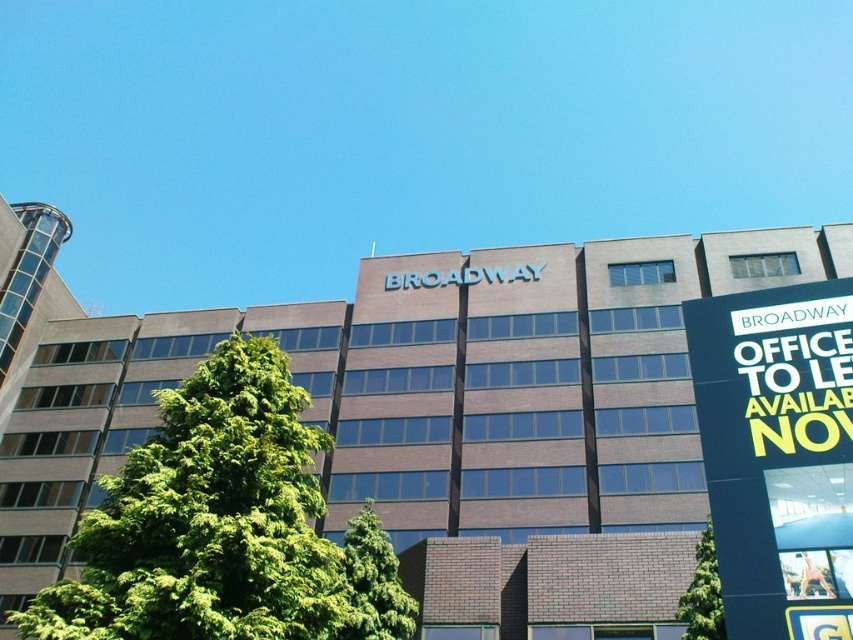
Question: Which point is closer to the camera?

Choices:
 (A) green leafy tree at left
 (B) blue plastic signboard at upper right
 (C) green leafy tree at center

Answer: (B)

Question: Which object appears closest to the camera in this image?

Choices:
 (A) green leafy tree at center
 (B) green leafy tree at left

Answer: (B)

Question: Considering the relative positions of green leafy tree at left and blue plastic signboard at upper right in the image provided, where is green leafy tree at left located with respect to blue plastic signboard at upper right?

Choices:
 (A) below
 (B) above

Answer: (A)

Question: Can you confirm if blue plastic signboard at upper right is thinner than green leafy tree at center?

Choices:
 (A) yes
 (B) no

Answer: (A)

Question: Which point appears closest to the camera in this image?

Choices:
 (A) (705, 604)
 (B) (792, 336)

Answer: (B)

Question: Is blue plastic signboard at upper right further to camera compared to green leafy tree at center?

Choices:
 (A) no
 (B) yes

Answer: (A)